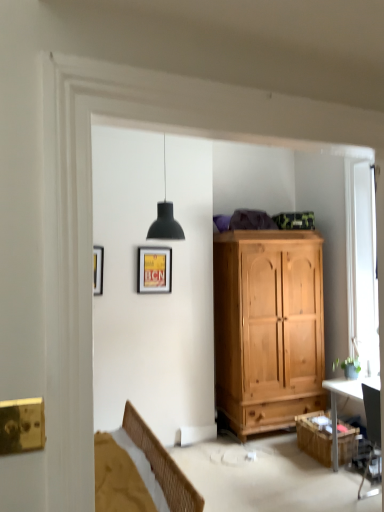
Question: Looking at the image, does wooden cabinet at lower right seem bigger or smaller compared to black glossy desk at right?

Choices:
 (A) small
 (B) big

Answer: (A)

Question: In terms of height, does wooden cabinet at lower right look taller or shorter compared to black glossy desk at right?

Choices:
 (A) short
 (B) tall

Answer: (A)

Question: Estimate the real-world distances between objects in this image. Which object is closer to the white wooden window at right?

Choices:
 (A) wooden cabinet at lower right
 (B) matte yellow poster at upper center
 (C) black glossy desk at right

Answer: (C)

Question: Based on their relative distances, which object is farther from the matte yellow poster at upper center?

Choices:
 (A) white wooden window at right
 (B) wooden cabinet at lower right
 (C) black glossy desk at right

Answer: (B)